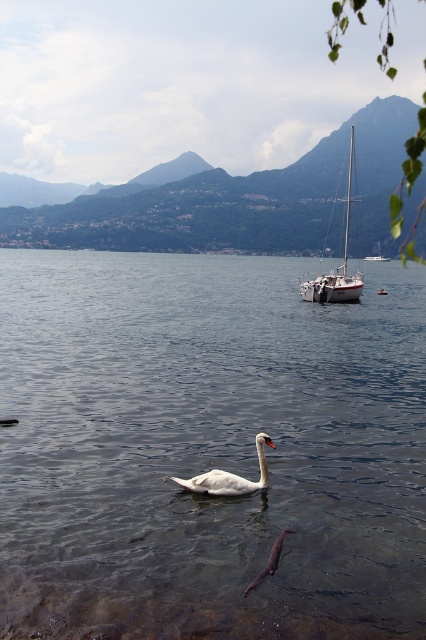
You are standing on the lakeside and want to take a photo of the white glossy sailboat at center and the clear water at center. Which object should you focus on first if you want to capture both in a single shot without moving the camera?

You should focus on the white glossy sailboat at center first because the clear water at center is located below it, so adjusting the focus to include both would require ensuring the sailboat is in the upper part of the frame and the water is below it.

You are an observer standing at the lakeside. You see the clear water at center and the shiny purple fish at lower center. Which object is located to the right of the other?

The shiny purple fish at lower center is located to the right of the clear water at center because the clear water at center is positioned on the left side of shiny purple fish at lower center.